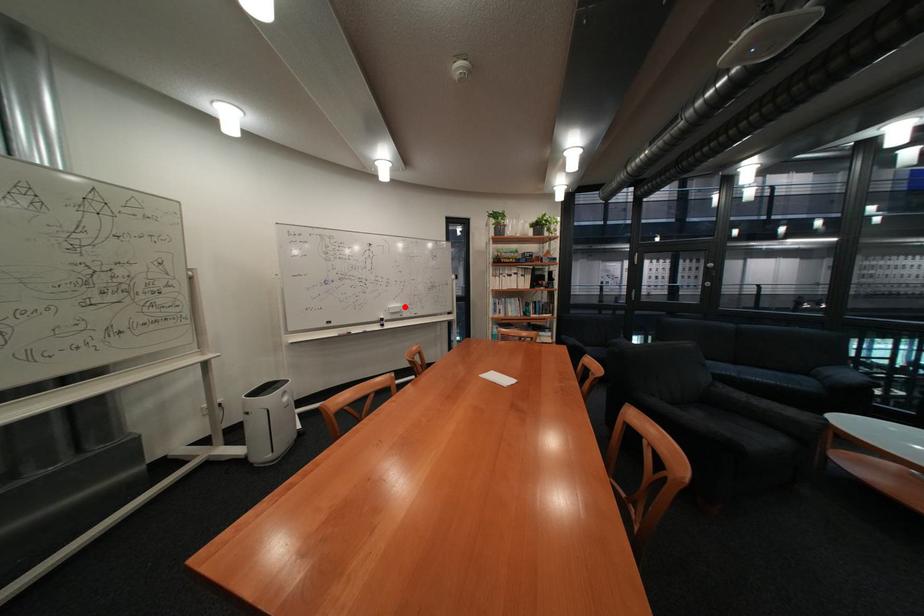
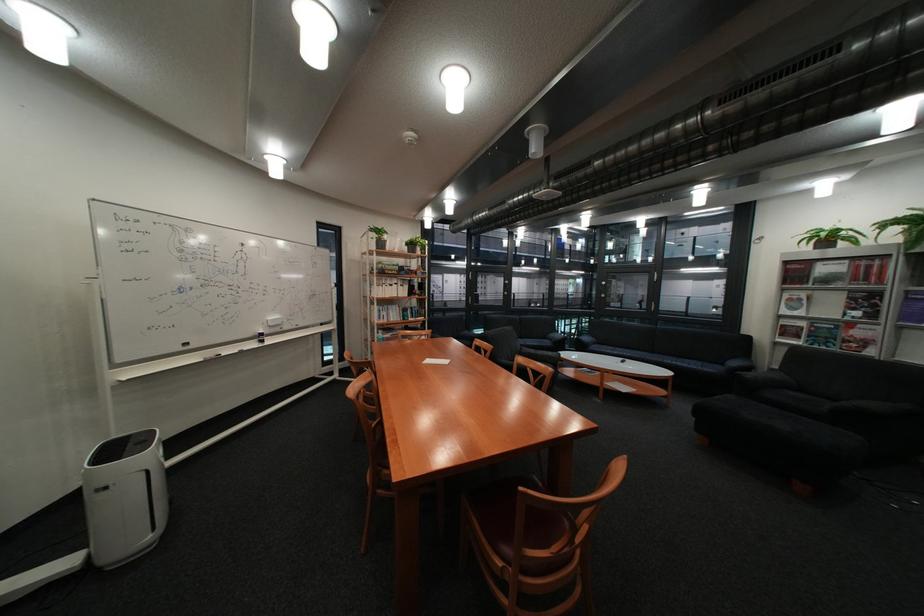
Question: I am providing you with two images of the same scene from different viewpoints. Given a red point in image1, look at the same physical point in image2. Is it:

Choices:
 (A) Closer to the viewpoint
 (B) Farther from the viewpoint

Answer: (A)